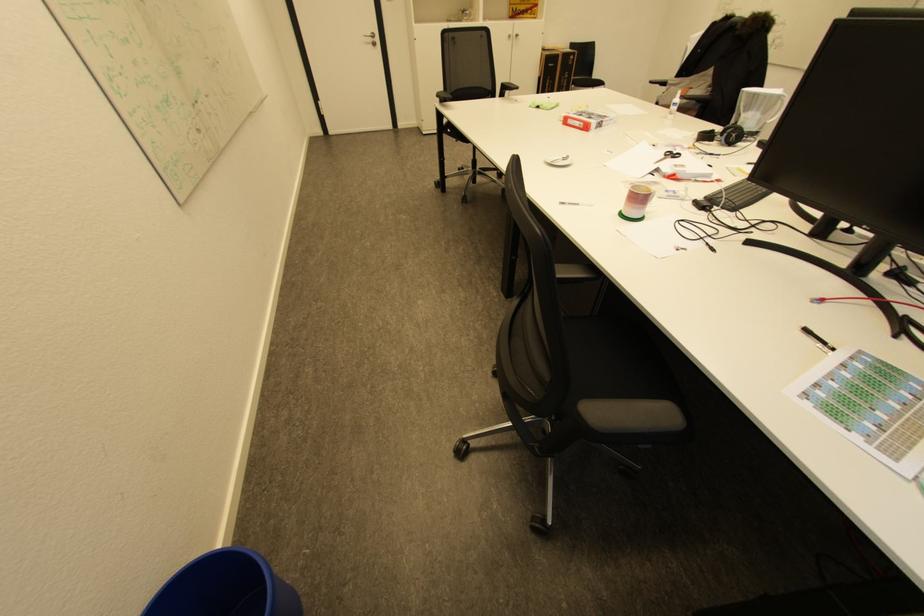
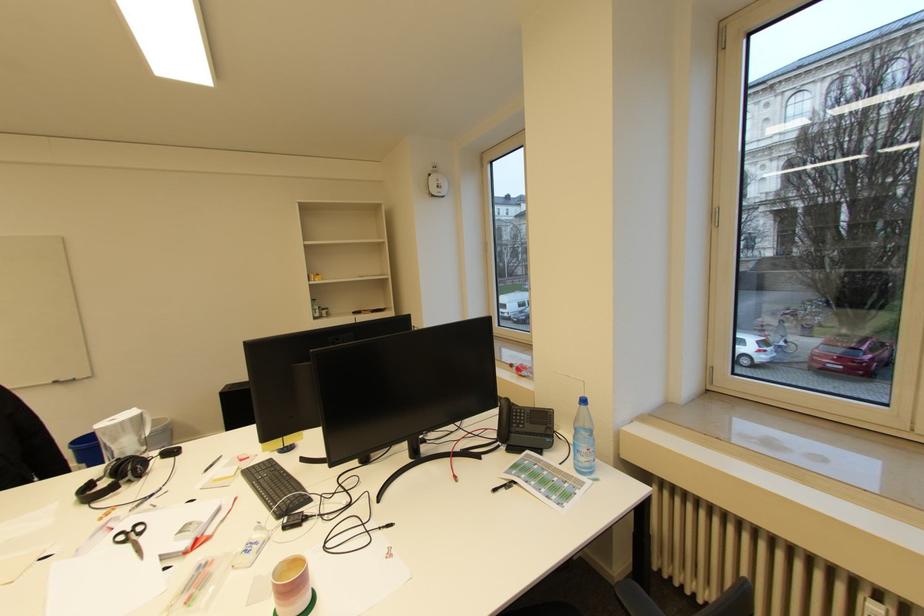
Find the pixel in the second image that matches [685,154] in the first image.

(141, 525)